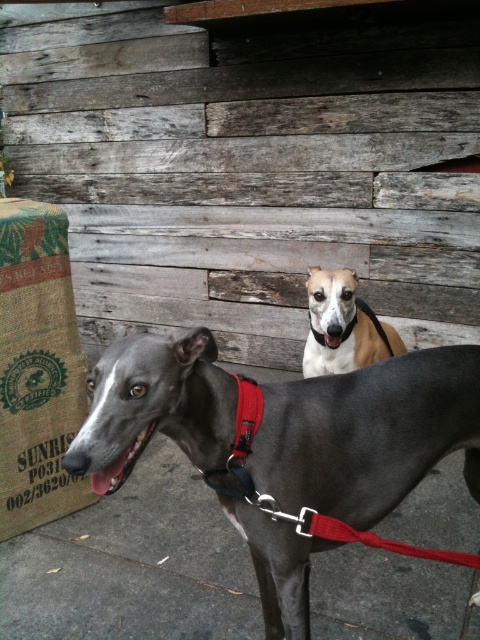
The width and height of the screenshot is (480, 640). What do you see at coordinates (283, 444) in the screenshot? I see `shiny black dog at center` at bounding box center [283, 444].

Which is in front, point (410, 476) or point (58, 269)?

Point (410, 476) is in front.

Where is `shiny black dog at center`? shiny black dog at center is located at coordinates click(283, 444).

Can you confirm if burlap sack at left is shorter than light brown fur at center?

No.

Image resolution: width=480 pixels, height=640 pixels. I want to click on burlap sack at left, so click(x=37, y=369).

Locate an element on the screen. This screenshot has width=480, height=640. burlap sack at left is located at coordinates (37, 369).

Is shiny black dog at center to the left of light brown fur at center from the viewer's perspective?

Yes, shiny black dog at center is to the left of light brown fur at center.

Can you confirm if shiny black dog at center is wider than light brown fur at center?

Correct, the width of shiny black dog at center exceeds that of light brown fur at center.

Who is more distant from viewer, (187, 403) or (316, 339)?

The point (316, 339) is behind.

Image resolution: width=480 pixels, height=640 pixels. Find the location of `shiny black dog at center`. shiny black dog at center is located at coordinates (283, 444).